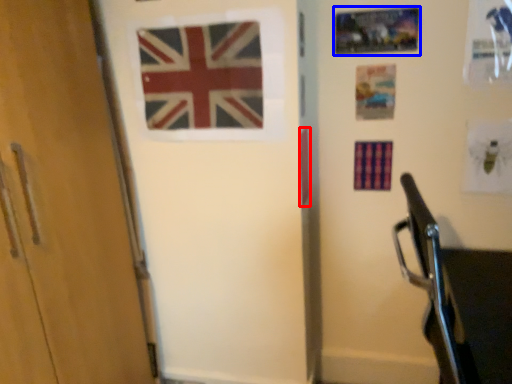
Question: Which point is further to the camera, flag (highlighted by a red box) or postcard (highlighted by a blue box)?

Choices:
 (A) flag
 (B) postcard

Answer: (A)